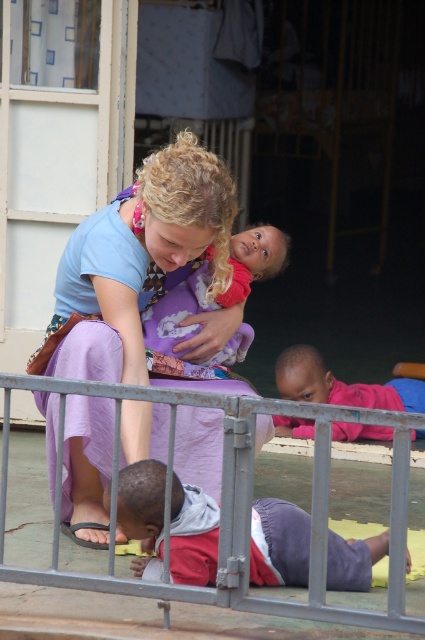
Question: Which of the following is the farthest from the observer?

Choices:
 (A) light purple fabric at center
 (B) soft purple cloth at center
 (C) metallic gray gate at lower center

Answer: (B)

Question: Based on their relative distances, which object is farther from the metallic gray gate at lower center?

Choices:
 (A) soft purple cloth at center
 (B) light purple fabric at center
 (C) reddish-purple fabric pants at lower center

Answer: (A)

Question: From the image, what is the correct spatial relationship of reddish-purple fabric pants at lower center in relation to pink fabric at lower right?

Choices:
 (A) below
 (B) above

Answer: (A)

Question: Does light purple fabric at center have a greater width compared to pink fabric at lower right?

Choices:
 (A) no
 (B) yes

Answer: (A)

Question: Among these points, which one is nearest to the camera?

Choices:
 (A) [206, 500]
 (B) [312, 435]
 (C) [244, 458]
 (D) [108, 323]

Answer: (C)

Question: Does metallic gray gate at lower center appear under reddish-purple fabric pants at lower center?

Choices:
 (A) no
 (B) yes

Answer: (A)